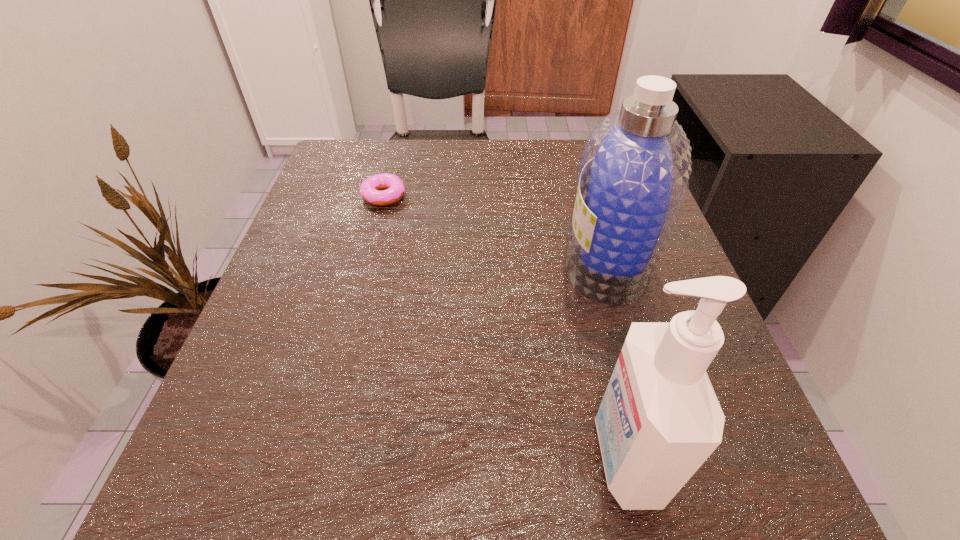
Where is `the farther cleansing agent`? The width and height of the screenshot is (960, 540). the farther cleansing agent is located at coordinates (635, 167).

Where is `the nearest object`? the nearest object is located at coordinates (659, 420).

At what (x,y) coordinates should I click in order to perform the action: click on the farthest object. Please return your answer as a coordinate pair (x, y). Looking at the image, I should click on (394, 186).

You are a GUI agent. You are given a task and a screenshot of the screen. Output one action in this format:
    pyautogui.click(x=<x>, y=<y>)
    Task: Click on the shortest object
    Image resolution: width=960 pixels, height=540 pixels.
    Given the screenshot: What is the action you would take?
    pyautogui.click(x=394, y=186)

Image resolution: width=960 pixels, height=540 pixels. I want to click on free region located on the back of the farther cleansing agent, so click(589, 201).

What are the coordinates of `free space located 0.400m on the front label of the nearer cleansing agent` in the screenshot? It's located at (276, 456).

Locate an element on the screen. vacant area located 0.100m on the front label of the nearer cleansing agent is located at coordinates (513, 456).

Locate an element on the screen. This screenshot has height=540, width=960. vacant space located on the front label of the nearer cleansing agent is located at coordinates [x=276, y=456].

Identify the location of free spot located 0.160m on the back of the doughnut. (396, 146).

At what (x,y) coordinates should I click in order to perform the action: click on object that is at the far edge. Please return your answer as a coordinate pair (x, y). This screenshot has width=960, height=540. Looking at the image, I should click on (394, 186).